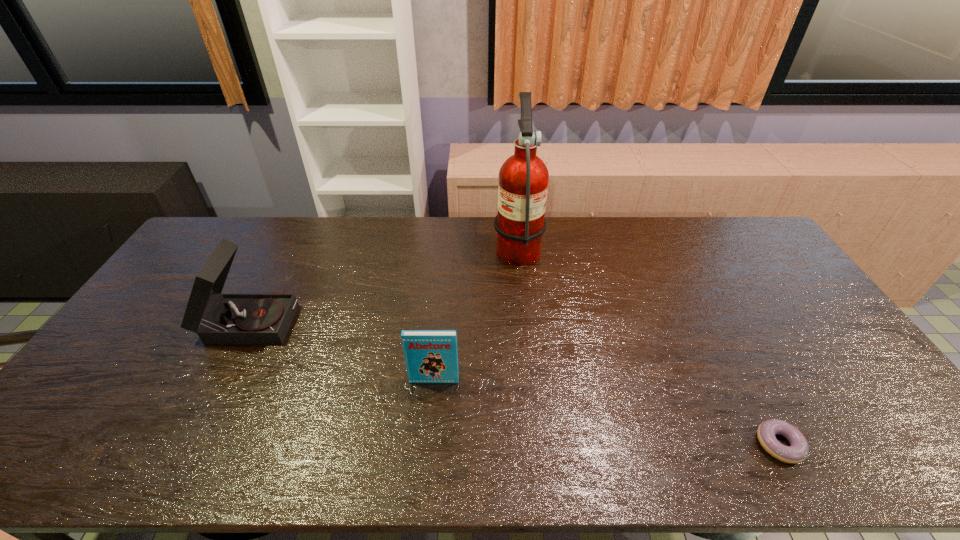
Find the location of a particular element. The width and height of the screenshot is (960, 540). the tallest object is located at coordinates (523, 178).

I want to click on the farthest object, so click(x=523, y=178).

You are a GUI agent. You are given a task and a screenshot of the screen. Output one action in this format:
    pyautogui.click(x=<x>, y=<y>)
    Task: Click on the third nearest object
    This screenshot has height=540, width=960.
    Given the screenshot: What is the action you would take?
    pyautogui.click(x=217, y=318)

Identify the location of the second tallest object. Image resolution: width=960 pixels, height=540 pixels. (217, 318).

The image size is (960, 540). In order to click on the third object from right to left in this screenshot , I will do `click(431, 356)`.

I want to click on the second nearest object, so click(431, 356).

At what (x,y) coordinates should I click in order to perform the action: click on the rightmost object. Please return your answer as a coordinate pair (x, y). The height and width of the screenshot is (540, 960). Looking at the image, I should click on (798, 450).

Locate an element on the screen. The image size is (960, 540). the nearest object is located at coordinates (798, 450).

Find the location of `vacant space located 0.390m on the nozzle and handle of the farthest object`. vacant space located 0.390m on the nozzle and handle of the farthest object is located at coordinates click(x=385, y=246).

Where is `vacant space located 0.250m on the nozzle and handle of the farthest object`? This screenshot has width=960, height=540. vacant space located 0.250m on the nozzle and handle of the farthest object is located at coordinates [x=424, y=246].